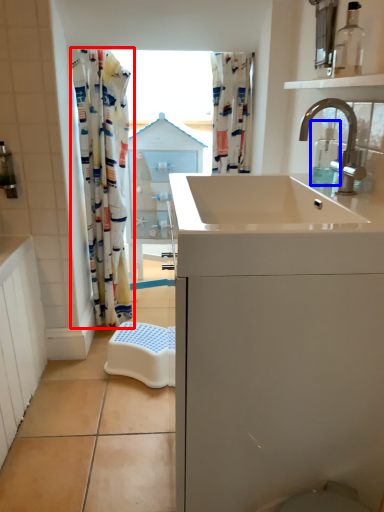
Question: Among these objects, which one is farthest to the camera, curtain (highlighted by a red box) or soap dispenser (highlighted by a blue box)?

Choices:
 (A) curtain
 (B) soap dispenser

Answer: (A)